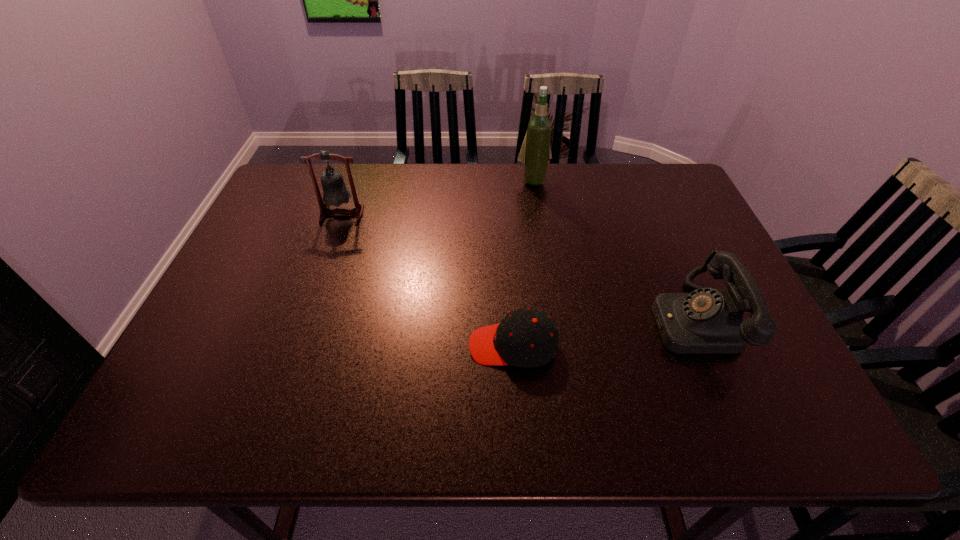
In order to click on the tallest object in this screenshot , I will do `click(535, 152)`.

You are a GUI agent. You are given a task and a screenshot of the screen. Output one action in this format:
    pyautogui.click(x=<x>, y=<y>)
    Task: Click on the wine bottle
    
    Given the screenshot: What is the action you would take?
    pyautogui.click(x=535, y=152)

Identify the location of bell. The height and width of the screenshot is (540, 960). (335, 193).

Image resolution: width=960 pixels, height=540 pixels. I want to click on the second farthest object, so click(x=335, y=193).

You are a GUI agent. You are given a task and a screenshot of the screen. Output one action in this format:
    pyautogui.click(x=<x>, y=<y>)
    Task: Click on the telephone
    
    Given the screenshot: What is the action you would take?
    pyautogui.click(x=706, y=321)

Find the location of a particular element. This screenshot has height=540, width=960. the rightmost object is located at coordinates (706, 321).

Locate an element on the screen. This screenshot has height=540, width=960. the shortest object is located at coordinates (527, 338).

Locate an element on the screen. Image resolution: width=960 pixels, height=540 pixels. vacant area situated on the front-facing side of the tallest object is located at coordinates (542, 240).

Locate an element on the screen. The image size is (960, 540). free point located on the left of the third nearest object is located at coordinates (299, 214).

Image resolution: width=960 pixels, height=540 pixels. Find the location of `free space located 0.140m on the dial of the telephone`. free space located 0.140m on the dial of the telephone is located at coordinates (593, 320).